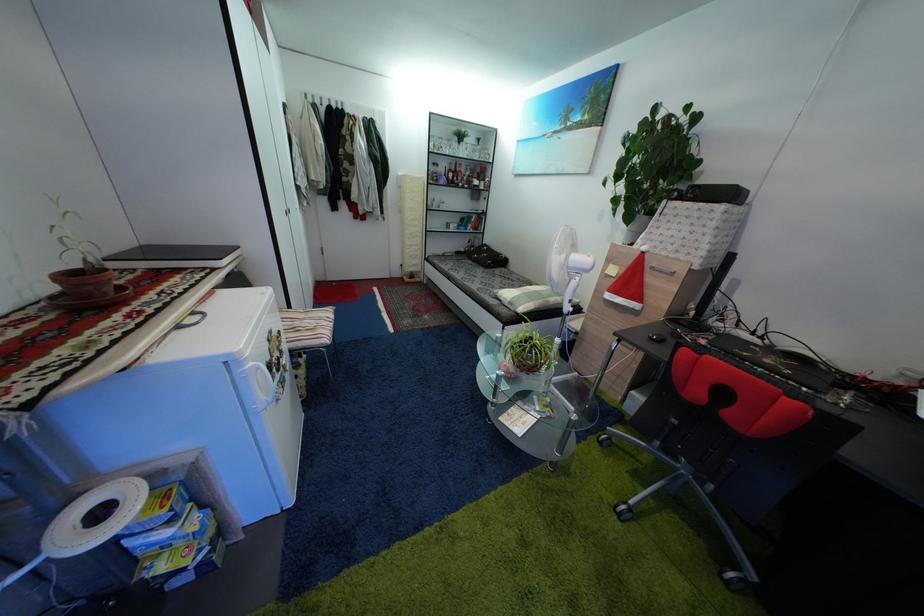
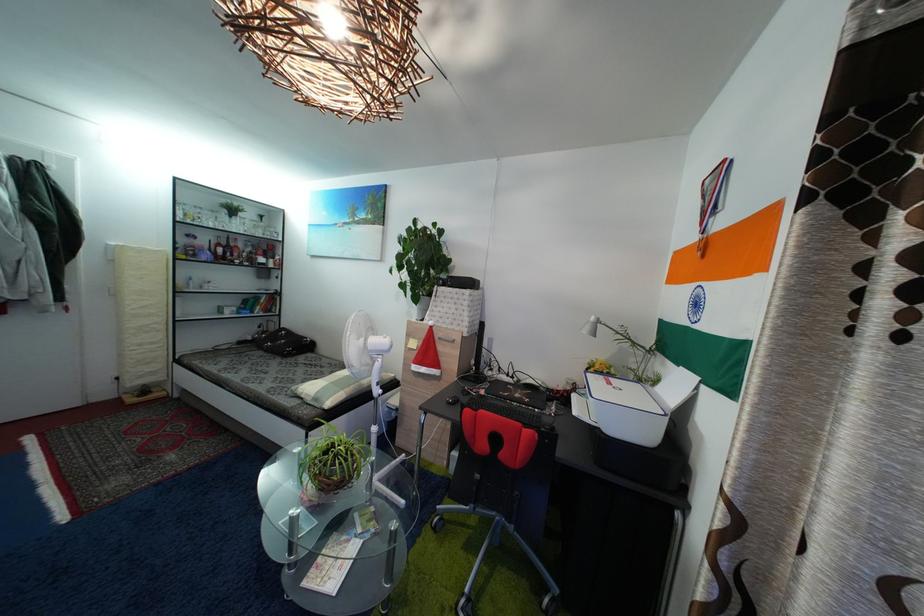
Question: I am providing you with two images of the same scene from different viewpoints. After the viewpoint changes to image2, which objects are now occluded?

Choices:
 (A) white lamp head
 (B) dark liquor bottle
 (C) red liquor bottle
 (D) none of these

Answer: (D)